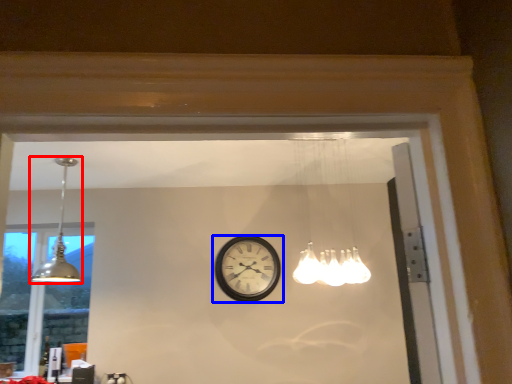
Question: Which object appears farthest to the camera in this image, lamp (highlighted by a red box) or wall clock (highlighted by a blue box)?

Choices:
 (A) lamp
 (B) wall clock

Answer: (B)